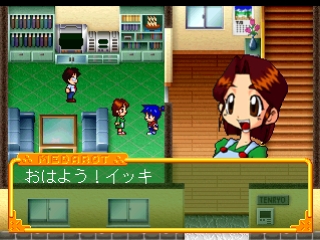
You are a GUI agent. You are given a task and a screenshot of the screen. Output one action in this format:
    pyautogui.click(x=<x>, y=<y>)
    Task: Click on the vase rose is in
    This screenshot has width=320, height=240.
    Given the screenshot: What is the action you would take?
    pyautogui.click(x=253, y=43)